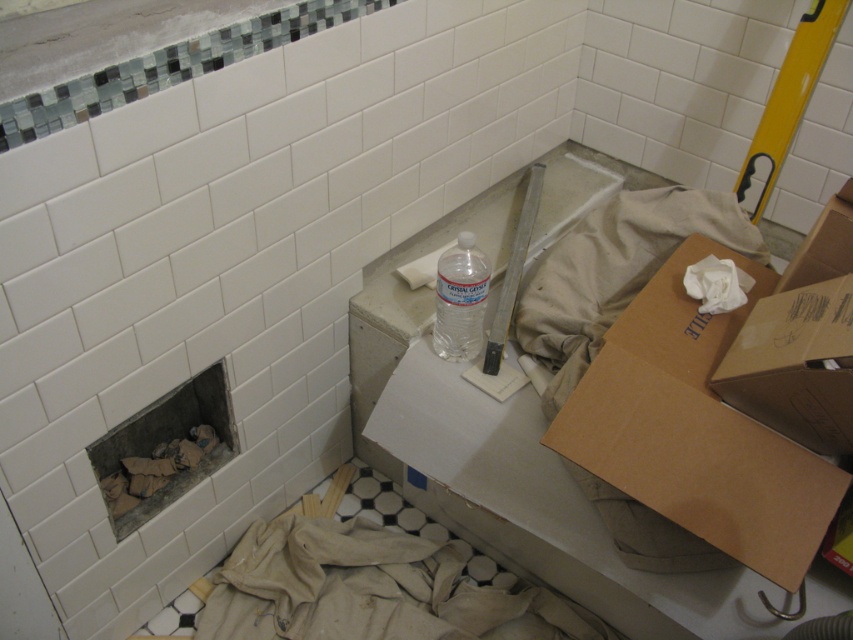
You are a construction worker who needs to reach the clear plastic bottle at center to refill your water. Considering your arm can extend 2.5 feet, can you reach it without moving closer?

The clear plastic bottle at center is 4.54 feet away from the camera, which is beyond your arm reach of 2.5 feet. You need to move closer to reach it.

Looking at this image, you are standing in the bathroom and want to pick up two points marked in the scene. Which point, point (x=606, y=445) or point (x=447, y=312), is nearer to you?

Point (x=606, y=445) is closer to the camera than point (x=447, y=312), so it is nearer to you.

You are a construction worker in the bathroom and need to place a new tool on the floor. There is a clear plastic bottle at center and a white matte toilet paper at center. Which object should you avoid placing the tool near to prevent it from rolling away?

You should avoid placing the tool near the clear plastic bottle at center because it is below the white matte toilet paper at center, so the tool might roll towards the lower position of the clear plastic bottle at center.